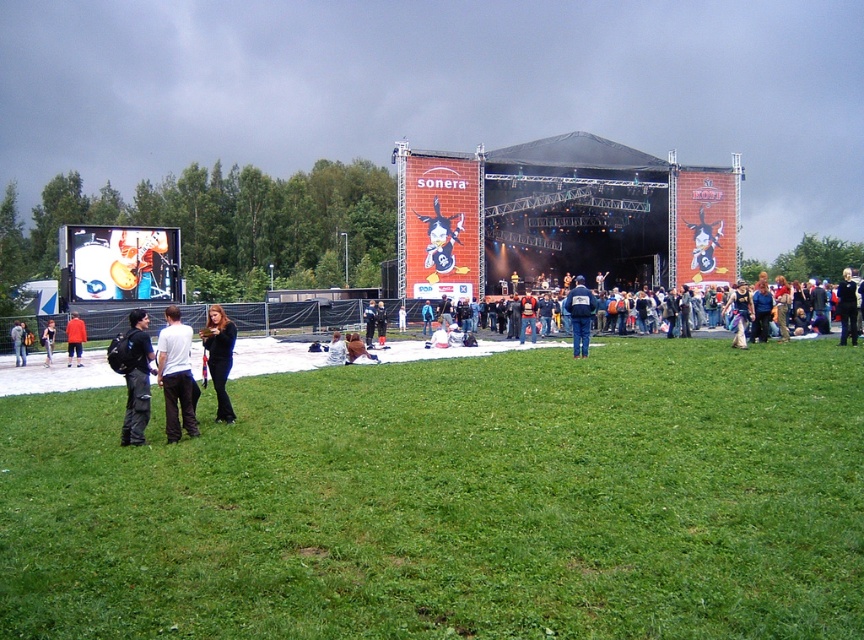
Question: Among these objects, which one is farthest from the camera?

Choices:
 (A) blue denim jacket at center
 (B) light brown leather jacket at center
 (C) green grassy field at lower center

Answer: (B)

Question: Can you confirm if green grassy field at lower center is positioned to the left of dark blue jeans at center?

Choices:
 (A) no
 (B) yes

Answer: (A)

Question: Which point appears farthest from the camera in this image?

Choices:
 (A) (86, 330)
 (B) (22, 339)
 (C) (175, 394)
 (D) (354, 336)

Answer: (A)

Question: Is dark blue backpack at lower left positioned before dark blue jacket at lower right?

Choices:
 (A) no
 (B) yes

Answer: (B)

Question: Which of the following is the closest to the observer?

Choices:
 (A) (348, 356)
 (B) (852, 312)
 (C) (563, 484)
 (D) (331, 355)

Answer: (C)

Question: Does dark blue backpack at lower left have a lesser width compared to dark blue jacket at lower right?

Choices:
 (A) yes
 (B) no

Answer: (A)